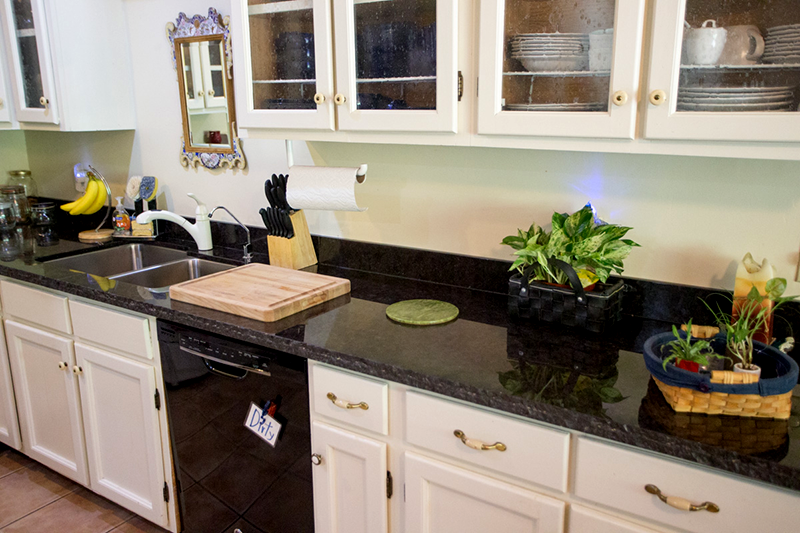
Locate an element on the screen. paper towel is located at coordinates (322, 184).